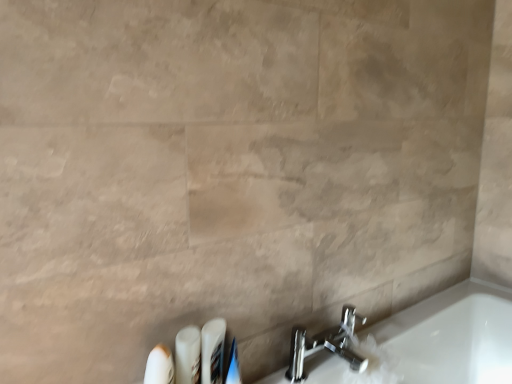
Image resolution: width=512 pixels, height=384 pixels. What do you see at coordinates (326, 345) in the screenshot?
I see `polished chrome faucet at lower right` at bounding box center [326, 345].

What is the approximate width of white plastic toothbrush at lower left, the 4th toiletry from the right?

2.52 inches.

What do you see at coordinates (233, 366) in the screenshot?
I see `white glossy toothpaste at lower center, which appears as the 4th toiletry when viewed from the left` at bounding box center [233, 366].

Locate an element on the screen. This screenshot has width=512, height=384. white plastic toothbrushes at lower center, the second toiletry from the right is located at coordinates (213, 351).

What are the coordinates of `polished chrome faucet at lower right` in the screenshot? It's located at (326, 345).

From the image's perspective, which is below, white glossy tube at lower center, the third toiletry positioned from the right, or white plastic toothbrush at lower left, the 4th toiletry from the right?

white plastic toothbrush at lower left, the 4th toiletry from the right, is shown below in the image.

Between white glossy tube at lower center, the 2th toiletry when ordered from left to right, and white plastic toothbrush at lower left, the 4th toiletry from the right, which one appears on the left side from the viewer's perspective?

white plastic toothbrush at lower left, the 4th toiletry from the right, is more to the left.

Considering the points (177, 381) and (154, 371), which point is in front, point (177, 381) or point (154, 371)?

The point (154, 371) is closer to the camera.

The image size is (512, 384). Identify the location of toiletry that is the 1st object to the right of the white plastic toothbrush at lower left, the 4th toiletry from the right, starting at the anchor. (188, 355).

Based on their positions, is white plastic toothbrushes at lower center, the second toiletry from the right, located to the left or right of polished chrome faucet at lower right?

Based on their positions, white plastic toothbrushes at lower center, the second toiletry from the right, is located to the left of polished chrome faucet at lower right.

Which object is further away from the camera, white plastic toothbrushes at lower center, the second toiletry from the right, or polished chrome faucet at lower right?

polished chrome faucet at lower right.

Based on the photo, does white plastic toothbrushes at lower center, the third toiletry positioned from the left, have a larger size compared to polished chrome faucet at lower right?

Actually, white plastic toothbrushes at lower center, the third toiletry positioned from the left, might be smaller than polished chrome faucet at lower right.

From the image's perspective, which is above, white glossy tube at lower center, the 2th toiletry when ordered from left to right, or polished chrome faucet at lower right?

white glossy tube at lower center, the 2th toiletry when ordered from left to right, is shown above in the image.

Would you say white glossy tube at lower center, the 2th toiletry when ordered from left to right, is inside or outside polished chrome faucet at lower right?

white glossy tube at lower center, the 2th toiletry when ordered from left to right, lies outside polished chrome faucet at lower right.

How many degrees apart are the facing directions of white glossy tube at lower center, the 2th toiletry when ordered from left to right, and polished chrome faucet at lower right?

They differ by 3.41 degrees in their facing directions.

Considering the relative sizes of white plastic toothbrushes at lower center, the third toiletry positioned from the left, and white glossy toothpaste at lower center, which is the 1th toiletry in right-to-left order, in the image provided, is white plastic toothbrushes at lower center, the third toiletry positioned from the left, shorter than white glossy toothpaste at lower center, which is the 1th toiletry in right-to-left order,?

No, white plastic toothbrushes at lower center, the third toiletry positioned from the left, is not shorter than white glossy toothpaste at lower center, which is the 1th toiletry in right-to-left order.

Considering the relative sizes of white plastic toothbrushes at lower center, the third toiletry positioned from the left, and white glossy toothpaste at lower center, which appears as the 4th toiletry when viewed from the left, in the image provided, is white plastic toothbrushes at lower center, the third toiletry positioned from the left, thinner than white glossy toothpaste at lower center, which appears as the 4th toiletry when viewed from the left,?

No, white plastic toothbrushes at lower center, the third toiletry positioned from the left, is not thinner than white glossy toothpaste at lower center, which appears as the 4th toiletry when viewed from the left.

Is white plastic toothbrushes at lower center, the second toiletry from the right, positioned in front of white glossy toothpaste at lower center, which appears as the 4th toiletry when viewed from the left?

Yes.

How different are the orientations of white glossy toothpaste at lower center, which is the 1th toiletry in right-to-left order, and white plastic toothbrush at lower left, the first toiletry from the left, in degrees?

white glossy toothpaste at lower center, which is the 1th toiletry in right-to-left order, and white plastic toothbrush at lower left, the first toiletry from the left, are facing 3.4 degrees away from each other.

From a real-world perspective, is white glossy toothpaste at lower center, which is the 1th toiletry in right-to-left order, beneath white plastic toothbrush at lower left, the 4th toiletry from the right?

Yes, from a real-world perspective, white glossy toothpaste at lower center, which is the 1th toiletry in right-to-left order, is under white plastic toothbrush at lower left, the 4th toiletry from the right.

Could you measure the distance between white glossy toothpaste at lower center, which is the 1th toiletry in right-to-left order, and white plastic toothbrush at lower left, the first toiletry from the left?

6.31 inches.

Is white glossy toothpaste at lower center, which is the 1th toiletry in right-to-left order, turned away from white plastic toothbrush at lower left, the first toiletry from the left?

white glossy toothpaste at lower center, which is the 1th toiletry in right-to-left order, does not have its back to white plastic toothbrush at lower left, the first toiletry from the left.

How different are the orientations of polished chrome faucet at lower right and white glossy toothpaste at lower center, which appears as the 4th toiletry when viewed from the left, in degrees?

46.5 degrees separate the facing orientations of polished chrome faucet at lower right and white glossy toothpaste at lower center, which appears as the 4th toiletry when viewed from the left.

Locate an element on the screen. the 1st toiletry to the left of the polished chrome faucet at lower right, starting your count from the anchor is located at coordinates (233, 366).

Consider the image. Which of these two, polished chrome faucet at lower right or white glossy toothpaste at lower center, which appears as the 4th toiletry when viewed from the left, is bigger?

polished chrome faucet at lower right is bigger.

Which is correct: polished chrome faucet at lower right is inside white glossy toothpaste at lower center, which is the 1th toiletry in right-to-left order, or outside of it?

polished chrome faucet at lower right cannot be found inside white glossy toothpaste at lower center, which is the 1th toiletry in right-to-left order.

From a real-world perspective, is white plastic toothbrush at lower left, the first toiletry from the left, located higher than polished chrome faucet at lower right?

Yes, from a real-world perspective, white plastic toothbrush at lower left, the first toiletry from the left, is on top of polished chrome faucet at lower right.

Is white plastic toothbrush at lower left, the 4th toiletry from the right, beside polished chrome faucet at lower right?

No, white plastic toothbrush at lower left, the 4th toiletry from the right, is not with polished chrome faucet at lower right.

Identify the location of the 1st toiletry below the polished chrome faucet at lower right (from the image's perspective). Image resolution: width=512 pixels, height=384 pixels. (159, 366).

The image size is (512, 384). Find the location of `toiletry located in front of the white glossy tube at lower center, the 2th toiletry when ordered from left to right`. toiletry located in front of the white glossy tube at lower center, the 2th toiletry when ordered from left to right is located at coordinates (159, 366).

What are the coordinates of `tap to the right of white plastic toothbrushes at lower center, the second toiletry from the right` in the screenshot? It's located at (326, 345).

When comparing their distances from white plastic toothbrush at lower left, the 4th toiletry from the right, does white glossy tube at lower center, the third toiletry positioned from the right, or polished chrome faucet at lower right seem closer?

Among the two, white glossy tube at lower center, the third toiletry positioned from the right, is located nearer to white plastic toothbrush at lower left, the 4th toiletry from the right.

Considering their positions, is white glossy toothpaste at lower center, which is the 1th toiletry in right-to-left order, positioned further to white plastic toothbrush at lower left, the 4th toiletry from the right, than white plastic toothbrushes at lower center, the second toiletry from the right?

Among the two, white glossy toothpaste at lower center, which is the 1th toiletry in right-to-left order, is located further to white plastic toothbrush at lower left, the 4th toiletry from the right.

From the image, which object appears to be farther from polished chrome faucet at lower right, white glossy tube at lower center, the third toiletry positioned from the right, or white plastic toothbrushes at lower center, the second toiletry from the right?

Based on the image, white glossy tube at lower center, the third toiletry positioned from the right, appears to be further to polished chrome faucet at lower right.

Which object lies further to the anchor point white plastic toothbrushes at lower center, the third toiletry positioned from the left, polished chrome faucet at lower right or white glossy tube at lower center, the 2th toiletry when ordered from left to right?

Among the two, polished chrome faucet at lower right is located further to white plastic toothbrushes at lower center, the third toiletry positioned from the left.

From the image, which object appears to be nearer to white glossy tube at lower center, the third toiletry positioned from the right, white glossy toothpaste at lower center, which is the 1th toiletry in right-to-left order, or white plastic toothbrush at lower left, the first toiletry from the left?

white plastic toothbrush at lower left, the first toiletry from the left, lies closer to white glossy tube at lower center, the third toiletry positioned from the right, than the other object.

Based on their spatial positions, is polished chrome faucet at lower right or white glossy toothpaste at lower center, which is the 1th toiletry in right-to-left order, closer to white glossy tube at lower center, the third toiletry positioned from the right?

white glossy toothpaste at lower center, which is the 1th toiletry in right-to-left order, is closer to white glossy tube at lower center, the third toiletry positioned from the right.

Which object lies nearer to the anchor point white plastic toothbrushes at lower center, the second toiletry from the right, white glossy toothpaste at lower center, which appears as the 4th toiletry when viewed from the left, or white plastic toothbrush at lower left, the 4th toiletry from the right?

white glossy toothpaste at lower center, which appears as the 4th toiletry when viewed from the left, is closer to white plastic toothbrushes at lower center, the second toiletry from the right.

Based on their spatial positions, is polished chrome faucet at lower right or white glossy tube at lower center, the 2th toiletry when ordered from left to right, closer to white glossy toothpaste at lower center, which appears as the 4th toiletry when viewed from the left?

Based on the image, white glossy tube at lower center, the 2th toiletry when ordered from left to right, appears to be nearer to white glossy toothpaste at lower center, which appears as the 4th toiletry when viewed from the left.

You are a GUI agent. You are given a task and a screenshot of the screen. Output one action in this format:
    pyautogui.click(x=<x>, y=<y>)
    Task: Click on the toiletry between white plastic toothbrushes at lower center, the third toiletry positioned from the left, and polished chrome faucet at lower right from left to right
    
    Given the screenshot: What is the action you would take?
    pyautogui.click(x=233, y=366)

Locate an element on the screen. toiletry situated between white glossy tube at lower center, the 2th toiletry when ordered from left to right, and white glossy toothpaste at lower center, which appears as the 4th toiletry when viewed from the left, from left to right is located at coordinates (213, 351).

The width and height of the screenshot is (512, 384). I want to click on toiletry between white plastic toothbrush at lower left, the first toiletry from the left, and white plastic toothbrushes at lower center, the third toiletry positioned from the left, along the z-axis, so click(x=188, y=355).